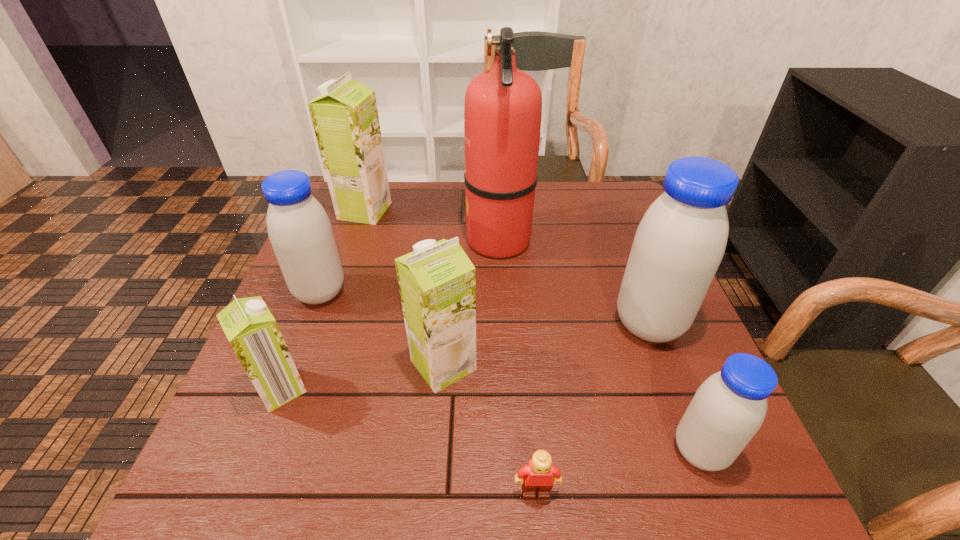
Image resolution: width=960 pixels, height=540 pixels. Identify the location of the tallest object. (503, 105).

Where is `red fire extinguisher`? red fire extinguisher is located at coordinates (503, 105).

The image size is (960, 540). I want to click on the farthest soya milk, so click(x=345, y=118).

I want to click on the biggest green soya milk, so click(x=345, y=118).

Where is `the biggest blue soya milk`? the biggest blue soya milk is located at coordinates (680, 242).

Where is `the second smallest green soya milk`? Image resolution: width=960 pixels, height=540 pixels. the second smallest green soya milk is located at coordinates (437, 281).

Locate an element on the screen. The image size is (960, 540). the fourth soya milk from left to right is located at coordinates (437, 281).

The height and width of the screenshot is (540, 960). What are the coordinates of `the second biggest blue soya milk` in the screenshot? It's located at (300, 232).

Image resolution: width=960 pixels, height=540 pixels. I want to click on the smallest green soya milk, so pyautogui.click(x=251, y=329).

Locate an element on the screen. The width and height of the screenshot is (960, 540). the smallest blue soya milk is located at coordinates (727, 410).